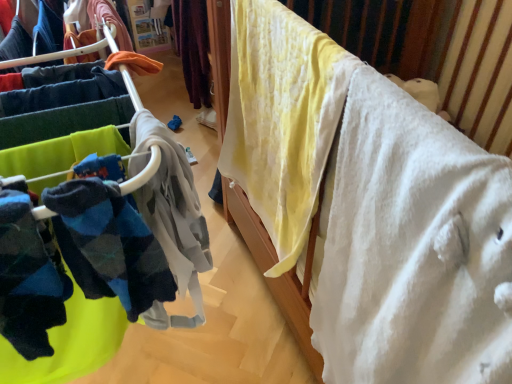
Question: Is yellow cotton blanket at upper right oriented away from white soft blanket at upper right?

Choices:
 (A) yes
 (B) no

Answer: (B)

Question: Is yellow cotton blanket at upper right surrounding white soft blanket at upper right?

Choices:
 (A) yes
 (B) no

Answer: (B)

Question: Considering the relative sizes of yellow cotton blanket at upper right and white soft blanket at upper right in the image provided, is yellow cotton blanket at upper right thinner than white soft blanket at upper right?

Choices:
 (A) no
 (B) yes

Answer: (B)

Question: From a real-world perspective, is yellow cotton blanket at upper right beneath white soft blanket at upper right?

Choices:
 (A) yes
 (B) no

Answer: (A)

Question: Is the surface of yellow cotton blanket at upper right in direct contact with white soft blanket at upper right?

Choices:
 (A) no
 (B) yes

Answer: (A)

Question: From the image's perspective, does yellow cotton blanket at upper right appear higher than white soft blanket at upper right?

Choices:
 (A) no
 (B) yes

Answer: (B)

Question: Is white soft blanket at upper right placed right next to soft fleece socks at left?

Choices:
 (A) yes
 (B) no

Answer: (B)

Question: Is white soft blanket at upper right shorter than soft fleece socks at left?

Choices:
 (A) yes
 (B) no

Answer: (A)

Question: Is soft fleece socks at left a part of white soft blanket at upper right?

Choices:
 (A) yes
 (B) no

Answer: (B)

Question: From the image's perspective, would you say white soft blanket at upper right is shown under soft fleece socks at left?

Choices:
 (A) yes
 (B) no

Answer: (A)

Question: Is white soft blanket at upper right located outside soft fleece socks at left?

Choices:
 (A) yes
 (B) no

Answer: (A)

Question: Can you confirm if white soft blanket at upper right is smaller than soft fleece socks at left?

Choices:
 (A) yes
 (B) no

Answer: (A)

Question: Does soft fleece socks at left have a greater width compared to white soft blanket at upper right?

Choices:
 (A) no
 (B) yes

Answer: (B)